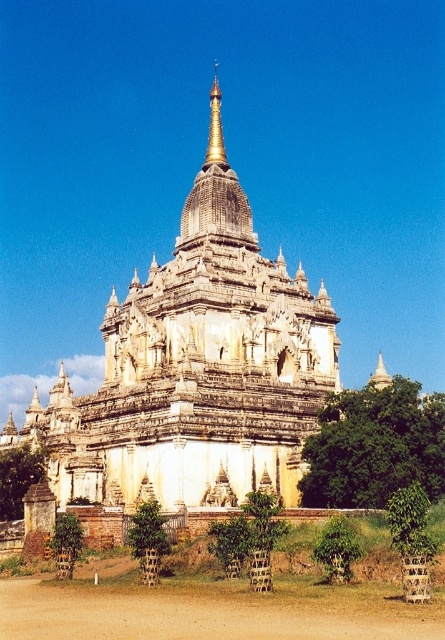
Does brown sandy dirt at lower center have a greater height compared to gold polished spire at center?

In fact, brown sandy dirt at lower center may be shorter than gold polished spire at center.

How far apart are brown sandy dirt at lower center and gold polished spire at center?

brown sandy dirt at lower center is 63.91 meters from gold polished spire at center.

Locate an element on the screen. This screenshot has width=445, height=640. brown sandy dirt at lower center is located at coordinates (178, 618).

Identify the location of brown sandy dirt at lower center. (178, 618).